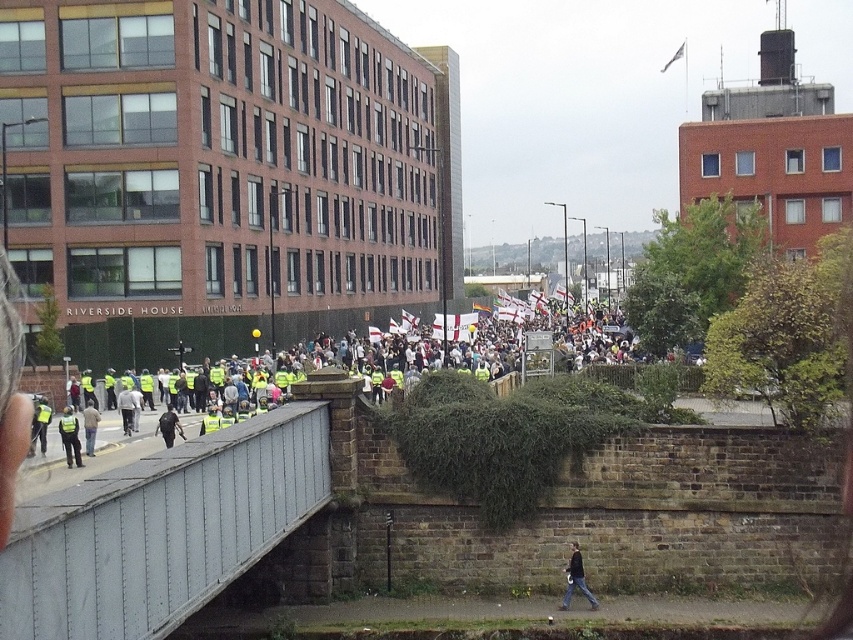
Does reflective yellow vest at lower left have a smaller size compared to light brown leather jacket at lower left?

Actually, reflective yellow vest at lower left might be larger than light brown leather jacket at lower left.

The width and height of the screenshot is (853, 640). Identify the location of reflective yellow vest at lower left. (70, 436).

Identify the location of white metal pedestrian bridge at lower left. (161, 531).

Who is higher up, white metal pedestrian bridge at lower left or light gray fabric jacket at center?

Positioned higher is white metal pedestrian bridge at lower left.

Locate an element on the screen. Image resolution: width=853 pixels, height=640 pixels. white metal pedestrian bridge at lower left is located at coordinates (161, 531).

Does white metal pedestrian bridge at lower left have a lesser height compared to reflective yellow vest at left?

No, white metal pedestrian bridge at lower left is not shorter than reflective yellow vest at left.

Is white metal pedestrian bridge at lower left below reflective yellow vest at left?

No, white metal pedestrian bridge at lower left is not below reflective yellow vest at left.

Is point (78, 564) less distant than point (39, 401)?

That is True.

The image size is (853, 640). What are the coordinates of `white metal pedestrian bridge at lower left` in the screenshot? It's located at (161, 531).